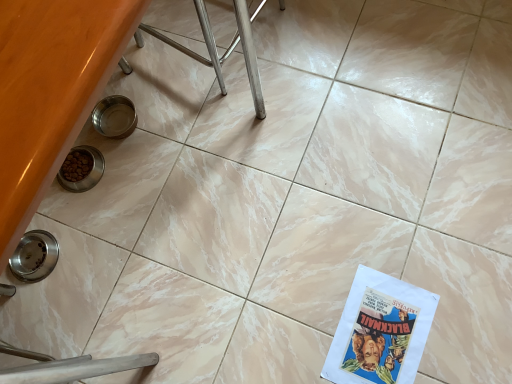
Find the location of `vacant area situated below brushed metal stool at upper center (from a real-world perspective)`. vacant area situated below brushed metal stool at upper center (from a real-world perspective) is located at coordinates (208, 34).